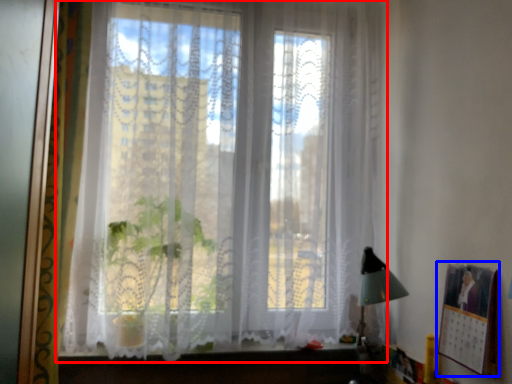
Question: Which object appears closest to the camera in this image, window (highlighted by a red box) or picture frame (highlighted by a blue box)?

Choices:
 (A) window
 (B) picture frame

Answer: (B)